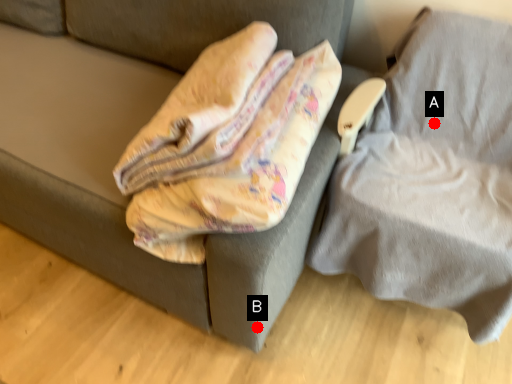
Question: Two points are circled on the image, labeled by A and B beside each circle. Which point is closer to the camera taking this photo?

Choices:
 (A) A is closer
 (B) B is closer

Answer: (B)